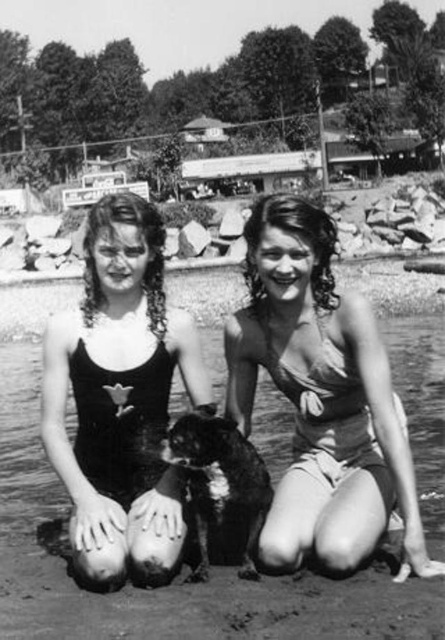
Is point (243, 232) positioned before point (129, 518)?

That is False.

You are a GUI agent. You are given a task and a screenshot of the screen. Output one action in this format:
    pyautogui.click(x=<x>, y=<y>)
    Task: Click on the smooth beige swimsuit at center
    
    Given the screenshot: What is the action you would take?
    pyautogui.click(x=322, y=397)

You are a GUI agent. You are given a task and a screenshot of the screen. Output one action in this format:
    pyautogui.click(x=<x>, y=<y>)
    Task: Click on the smooth beige swimsuit at center
    
    Given the screenshot: What is the action you would take?
    pyautogui.click(x=322, y=397)

Where is `smooth beige swimsuit at center`? This screenshot has width=445, height=640. smooth beige swimsuit at center is located at coordinates (322, 397).

Which is in front, point (35, 490) or point (409, 522)?

Point (409, 522)

Is black matte water at center bigger than smooth beige swimsuit at center?

Correct, black matte water at center is larger in size than smooth beige swimsuit at center.

Locate an element on the screen. This screenshot has width=445, height=640. black matte water at center is located at coordinates (174, 580).

Which is behind, point (250, 387) or point (226, 502)?

Positioned behind is point (250, 387).

Is point (258, 307) in front of point (178, 420)?

No, it is behind (178, 420).

The width and height of the screenshot is (445, 640). In order to click on smooth beige swimsuit at center in this screenshot , I will do (x=322, y=397).